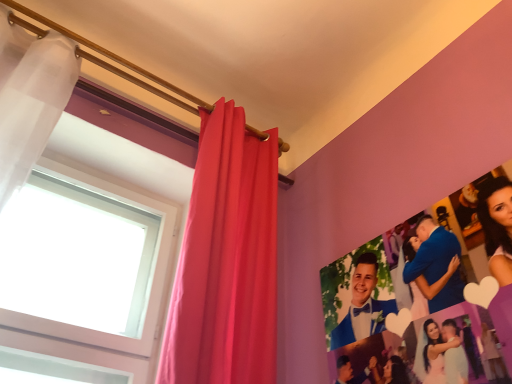
What do you see at coordinates (226, 261) in the screenshot? The height and width of the screenshot is (384, 512). I see `matte pink curtain at upper left` at bounding box center [226, 261].

This screenshot has width=512, height=384. In order to click on matte pink curtain at upper left in this screenshot , I will do `click(226, 261)`.

Locate an element on the screen. This screenshot has width=512, height=384. matte pink curtain at upper left is located at coordinates (226, 261).